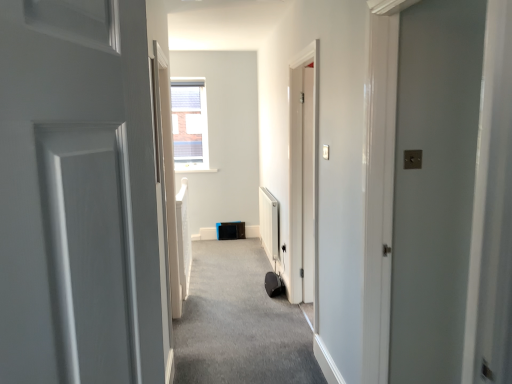
Locate an element on the screen. Image resolution: width=512 pixels, height=384 pixels. carpeted carpet at center is located at coordinates (240, 323).

The image size is (512, 384). What do you see at coordinates (240, 323) in the screenshot?
I see `carpeted carpet at center` at bounding box center [240, 323].

The image size is (512, 384). Identify the location of white glossy door at right. (434, 186).

Describe the element at coordinates (434, 186) in the screenshot. I see `white glossy door at right` at that location.

Locate an element on the screen. The height and width of the screenshot is (384, 512). carpeted carpet at center is located at coordinates (240, 323).

Considering the relative positions of carpeted carpet at center and white glossy door at right in the image provided, is carpeted carpet at center to the left of white glossy door at right from the viewer's perspective?

Correct, you'll find carpeted carpet at center to the left of white glossy door at right.

Is carpeted carpet at center in front of or behind white glossy door at right in the image?

In the image, carpeted carpet at center appears behind white glossy door at right.

Which is closer to the camera, (225, 327) or (430, 78)?

Positioned in front is point (430, 78).

From the image's perspective, between carpeted carpet at center and white glossy door at right, which one is located above?

From the image's view, white glossy door at right is above.

Looking at this image, from a real-world perspective, between carpeted carpet at center and white glossy door at right, who is vertically higher?

white glossy door at right is physically above.

Which of these two, carpeted carpet at center or white glossy door at right, is wider?

Wider between the two is carpeted carpet at center.

In terms of height, does carpeted carpet at center look taller or shorter compared to white glossy door at right?

Clearly, carpeted carpet at center is shorter compared to white glossy door at right.

Which of these two, carpeted carpet at center or white glossy door at right, is bigger?

white glossy door at right is bigger.

In the scene shown: Is carpeted carpet at center positioned beyond the bounds of white glossy door at right?

Yes, carpeted carpet at center is outside of white glossy door at right.

Would you say carpeted carpet at center is a long distance from white glossy door at right?

carpeted carpet at center is positioned a significant distance from white glossy door at right.

Is carpeted carpet at center positioned with its back to white glossy door at right?

No, carpeted carpet at center is not facing away from white glossy door at right.

How different are the orientations of carpeted carpet at center and white glossy door at right in degrees?

They differ by 90 degrees in their facing directions.

The image size is (512, 384). Find the location of `corridor that is on the left side of white glossy door at right`. corridor that is on the left side of white glossy door at right is located at coordinates click(x=240, y=323).

Based on their positions, is white glossy door at right located to the left or right of carpeted carpet at center?

Based on their positions, white glossy door at right is located to the right of carpeted carpet at center.

Is white glossy door at right closer to the viewer compared to carpeted carpet at center?

Yes, white glossy door at right is in front of carpeted carpet at center.

Is point (440, 158) more distant than point (251, 255)?

No, it is not.

From the image's perspective, is white glossy door at right located above or below carpeted carpet at center?

Clearly, from the image's perspective, white glossy door at right is above carpeted carpet at center.

From a real-world perspective, is white glossy door at right physically below carpeted carpet at center?

No, from a real-world perspective, white glossy door at right is not below carpeted carpet at center.

From the picture: Between white glossy door at right and carpeted carpet at center, which one has smaller width?

Thinner between the two is white glossy door at right.

Is white glossy door at right taller or shorter than carpeted carpet at center?

white glossy door at right is taller than carpeted carpet at center.

In terms of size, does white glossy door at right appear bigger or smaller than carpeted carpet at center?

white glossy door at right is bigger than carpeted carpet at center.

Is carpeted carpet at center located within white glossy door at right?

That's incorrect, carpeted carpet at center is not inside white glossy door at right.

Is white glossy door at right not near carpeted carpet at center?

white glossy door at right is far away from carpeted carpet at center.

Is white glossy door at right aimed at carpeted carpet at center?

No, white glossy door at right is not turned towards carpeted carpet at center.

How different are the orientations of white glossy door at right and carpeted carpet at center in degrees?

90 degrees separate the facing orientations of white glossy door at right and carpeted carpet at center.

Find the location of a particular element. door lying in front of the carpeted carpet at center is located at coordinates (434, 186).

At what (x,y) coordinates should I click in order to perform the action: click on corridor on the left of white glossy door at right. Please return your answer as a coordinate pair (x, y). Looking at the image, I should click on (240, 323).

Find the location of a particular element. door located on the right of carpeted carpet at center is located at coordinates (434, 186).